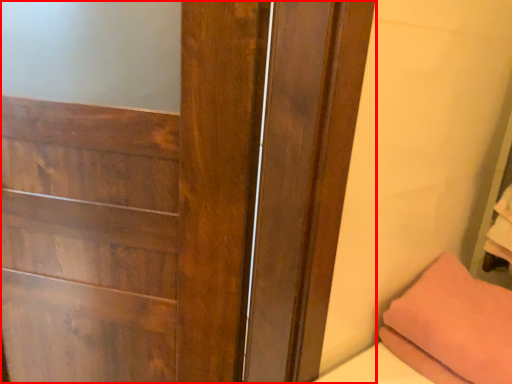
Question: From the image's perspective, what is the correct spatial relationship of door (annotated by the red box) in relation to pillow?

Choices:
 (A) above
 (B) below

Answer: (A)